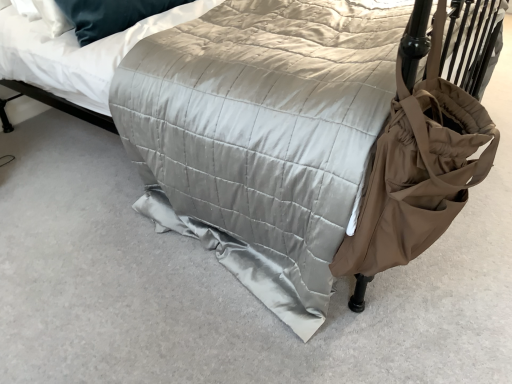
Where is `silky white mattress at upper center`? silky white mattress at upper center is located at coordinates (77, 54).

Measure the distance between point (x=10, y=37) and camera.

1.66 meters.

What do you see at coordinates (77, 54) in the screenshot?
I see `silky white mattress at upper center` at bounding box center [77, 54].

What do you see at coordinates (424, 153) in the screenshot? I see `brown fabric bag at right` at bounding box center [424, 153].

This screenshot has width=512, height=384. I want to click on brown fabric bag at right, so click(x=424, y=153).

The width and height of the screenshot is (512, 384). In order to click on silky white mattress at upper center in this screenshot , I will do `click(77, 54)`.

Is brown fabric bag at right to the right of silky white mattress at upper center from the viewer's perspective?

Yes.

Based on the photo, considering the positions of objects brown fabric bag at right and silky white mattress at upper center in the image provided, who is in front, brown fabric bag at right or silky white mattress at upper center?

brown fabric bag at right.

Considering the positions of point (422, 224) and point (57, 83), is point (422, 224) closer or farther from the camera than point (57, 83)?

Clearly, point (422, 224) is closer to the camera than point (57, 83).

From the image's perspective, would you say brown fabric bag at right is shown under silky white mattress at upper center?

Indeed, from the image's perspective, brown fabric bag at right is shown beneath silky white mattress at upper center.

From a real-world perspective, between brown fabric bag at right and silky white mattress at upper center, who is vertically higher?

silky white mattress at upper center, from a real-world perspective.

Which of these two, brown fabric bag at right or silky white mattress at upper center, is thinner?

brown fabric bag at right is thinner.

From their relative heights in the image, would you say brown fabric bag at right is taller or shorter than silky white mattress at upper center?

Considering their sizes, brown fabric bag at right has more height than silky white mattress at upper center.

In the scene shown: Looking at the image, does brown fabric bag at right seem bigger or smaller compared to silky white mattress at upper center?

Clearly, brown fabric bag at right is smaller in size than silky white mattress at upper center.

Looking at this image, which is correct: brown fabric bag at right is inside silky white mattress at upper center, or outside of it?

brown fabric bag at right is not enclosed by silky white mattress at upper center.

Are brown fabric bag at right and silky white mattress at upper center far apart?

Indeed, brown fabric bag at right is not near silky white mattress at upper center.

Is brown fabric bag at right oriented towards silky white mattress at upper center?

No, brown fabric bag at right is not turned towards silky white mattress at upper center.

Can you tell me how much brown fabric bag at right and silky white mattress at upper center differ in facing direction?

There is a 3.09-degree angle between the facing directions of brown fabric bag at right and silky white mattress at upper center.

In the scene shown: How distant is brown fabric bag at right from silky white mattress at upper center?

brown fabric bag at right and silky white mattress at upper center are 3.61 feet apart from each other.

Locate an element on the screen. The width and height of the screenshot is (512, 384). mattress on the left of brown fabric bag at right is located at coordinates (77, 54).

Does silky white mattress at upper center appear on the left side of brown fabric bag at right?

Correct, you'll find silky white mattress at upper center to the left of brown fabric bag at right.

Is silky white mattress at upper center in front of brown fabric bag at right?

No, it is behind brown fabric bag at right.

Which is further, (101,95) or (485,3)?

Point (485,3)

From the image's perspective, is silky white mattress at upper center on top of brown fabric bag at right?

Yes.

From a real-world perspective, is silky white mattress at upper center physically above brown fabric bag at right?

Indeed, from a real-world perspective, silky white mattress at upper center stands above brown fabric bag at right.

Looking at their sizes, would you say silky white mattress at upper center is wider or thinner than brown fabric bag at right?

Considering their sizes, silky white mattress at upper center looks broader than brown fabric bag at right.

Considering the sizes of objects silky white mattress at upper center and brown fabric bag at right in the image provided, who is taller, silky white mattress at upper center or brown fabric bag at right?

With more height is brown fabric bag at right.

Which of these two, silky white mattress at upper center or brown fabric bag at right, is bigger?

silky white mattress at upper center is bigger.

Is brown fabric bag at right located within silky white mattress at upper center?

Definitely not — brown fabric bag at right is not inside silky white mattress at upper center.

Is silky white mattress at upper center next to brown fabric bag at right and touching it?

They are not placed beside each other.

Is silky white mattress at upper center aimed at brown fabric bag at right?

Yes, silky white mattress at upper center is aimed at brown fabric bag at right.

Measure the distance between silky white mattress at upper center and brown fabric bag at right.

silky white mattress at upper center is 3.61 feet from brown fabric bag at right.

This screenshot has height=384, width=512. I want to click on mattress to the left of brown fabric bag at right, so click(x=77, y=54).

Where is `bag that appears below the silky white mattress at upper center (from the image's perspective)`? bag that appears below the silky white mattress at upper center (from the image's perspective) is located at coordinates (424, 153).

At what (x,y) coordinates should I click in order to perform the action: click on mattress that is above the brown fabric bag at right (from the image's perspective). Please return your answer as a coordinate pair (x, y). The image size is (512, 384). Looking at the image, I should click on [77, 54].